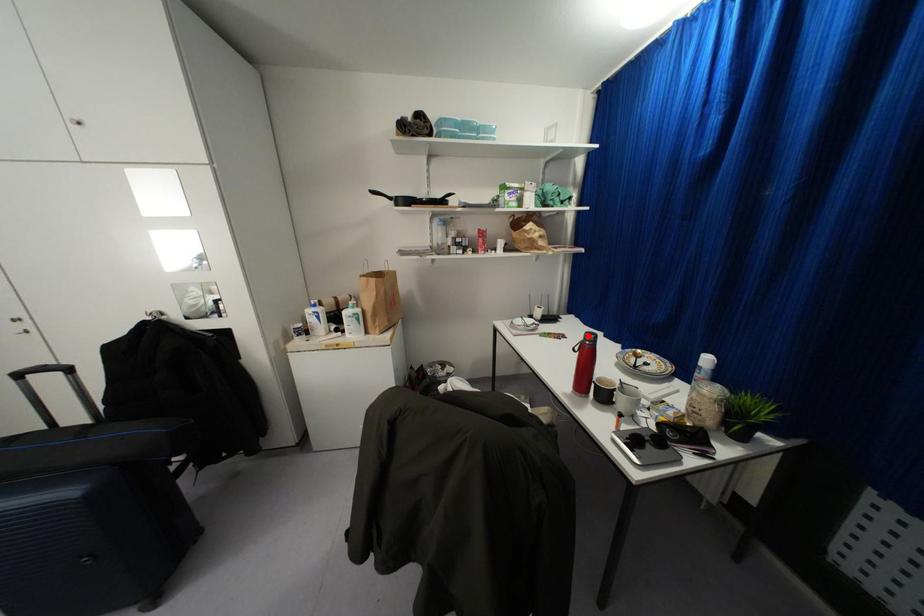
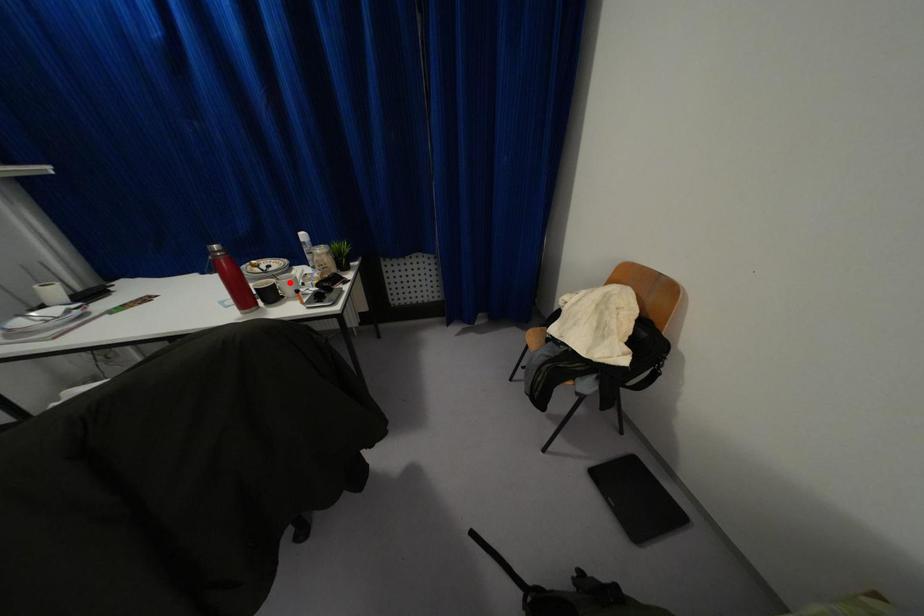
I am providing you with two images of the same scene from different viewpoints. A red point is marked on the first image and another point is marked on the second image. Is the marked point in image1 the same physical position as the marked point in image2?

No